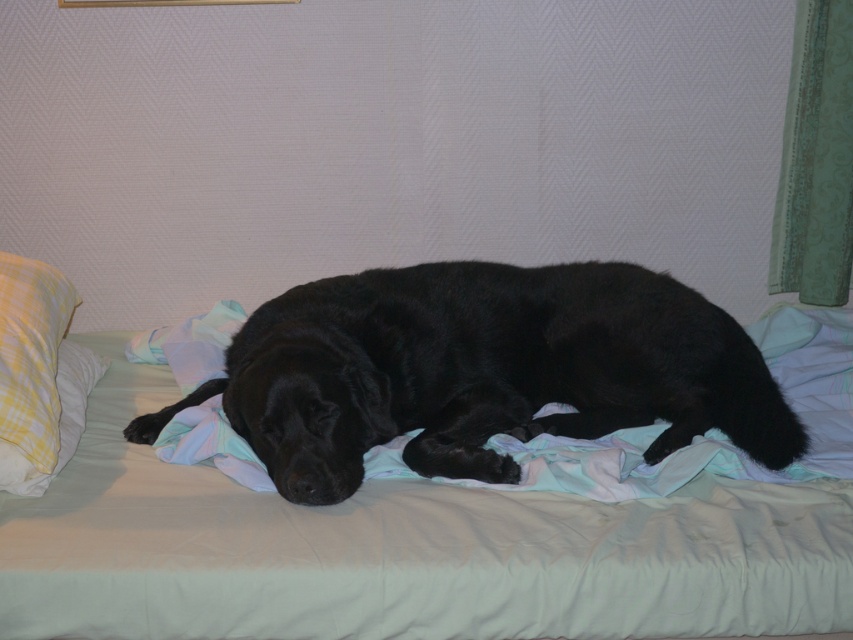
Question: Which point appears closest to the camera in this image?

Choices:
 (A) (32, 422)
 (B) (340, 310)

Answer: (A)

Question: Which of the following is the closest to the observer?

Choices:
 (A) black soft fur dog at center
 (B) yellow plaid pillow at left

Answer: (B)

Question: Which point is farther from the camera taking this photo?

Choices:
 (A) (144, 605)
 (B) (619, 419)
 (C) (33, 397)

Answer: (B)

Question: Does black soft fur dog at center lie behind yellow plaid pillow at left?

Choices:
 (A) yes
 (B) no

Answer: (A)

Question: Is black soft fur dog at center below yellow plaid pillow at left?

Choices:
 (A) yes
 (B) no

Answer: (A)

Question: From the image, what is the correct spatial relationship of silky black dog at center in relation to black soft fur dog at center?

Choices:
 (A) left
 (B) right

Answer: (A)